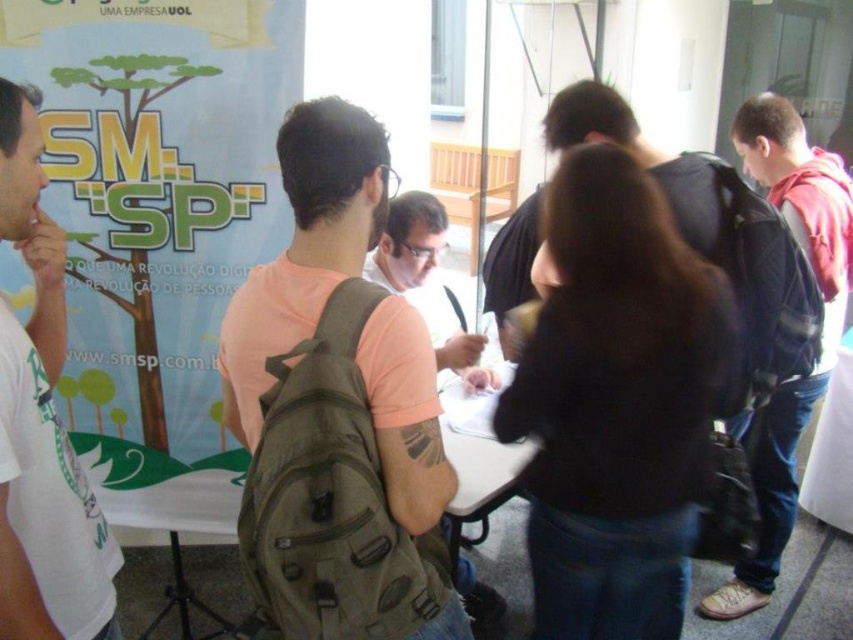
Consider the image. You are an attendee at this event and you want to retrieve your olive green canvas backpack at center and camouflage backpack at center from the floor. Which backpack should you pick up first if you want to get the one that is harder to reach?

The camouflage backpack at center is harder to reach because it is located above the olive green canvas backpack at center.